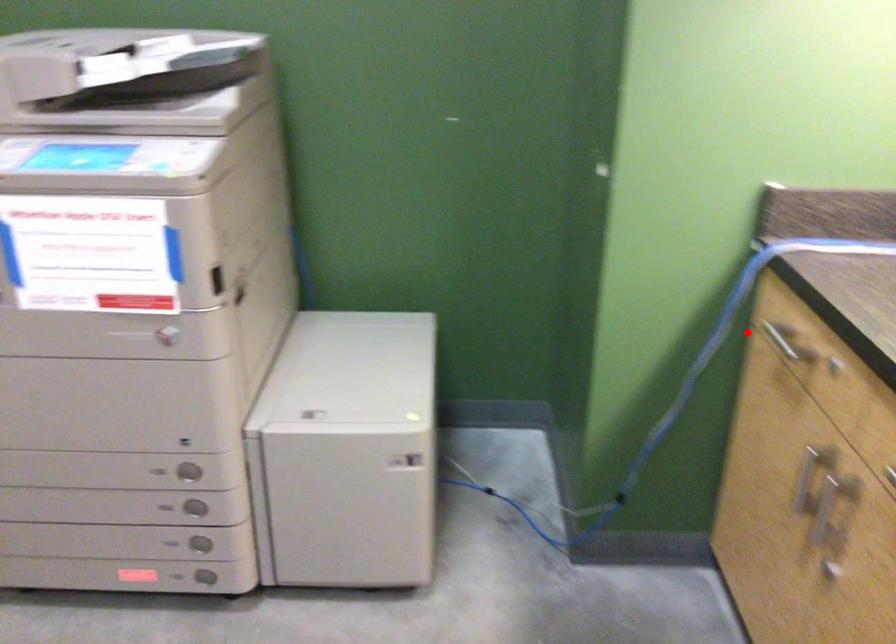
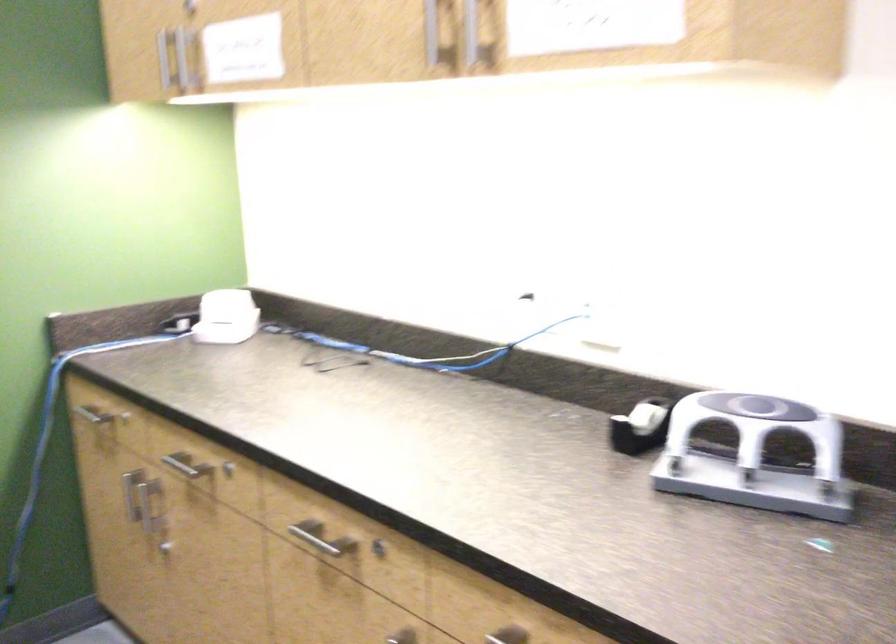
Question: I am providing you with two images of the same scene from different viewpoints. Image1 has a red point marked. In image2, the corresponding 3D location appears at what relative position? Reply with the corresponding letter.

Choices:
 (A) Closer
 (B) Farther

Answer: (B)